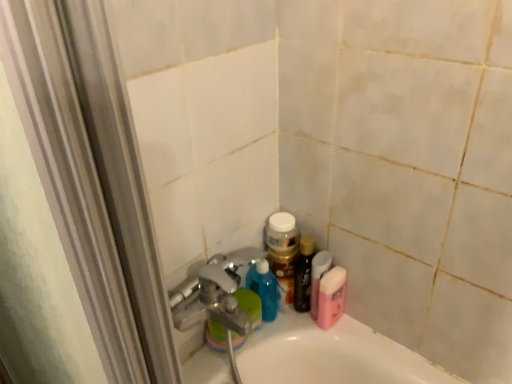
This screenshot has height=384, width=512. What do you see at coordinates (331, 297) in the screenshot? I see `pink matte bottle at lower right, which ranks as the 1th mouthwash in right-to-left order` at bounding box center [331, 297].

Locate an element on the screen. pink matte bottle at lower right, which is the second mouthwash from left to right is located at coordinates (331, 297).

Locate an element on the screen. mouthwash below the pink glossy bottle at upper right, which is the first mouthwash in left-to-right order (from a real-world perspective) is located at coordinates (331, 297).

What's the angular difference between pink matte bottle at lower right, which is the second mouthwash from left to right, and pink glossy bottle at upper right, which is the first mouthwash in left-to-right order,'s facing directions?

There is a 0.00181-degree angle between the facing directions of pink matte bottle at lower right, which is the second mouthwash from left to right, and pink glossy bottle at upper right, which is the first mouthwash in left-to-right order.

Who is bigger, pink matte bottle at lower right, which is the second mouthwash from left to right, or pink glossy bottle at upper right, marked as the second mouthwash in a right-to-left arrangement?

pink matte bottle at lower right, which is the second mouthwash from left to right.

In the scene shown: Can you confirm if pink matte bottle at lower right, which ranks as the 1th mouthwash in right-to-left order, is positioned to the right of pink glossy bottle at upper right, which is the first mouthwash in left-to-right order?

Yes, pink matte bottle at lower right, which ranks as the 1th mouthwash in right-to-left order, is to the right of pink glossy bottle at upper right, which is the first mouthwash in left-to-right order.

Is pink glossy bottle at upper right, which is the first mouthwash in left-to-right order, taller than shiny brown bottle at lower right?

No, pink glossy bottle at upper right, which is the first mouthwash in left-to-right order, is not taller than shiny brown bottle at lower right.

Are pink glossy bottle at upper right, marked as the second mouthwash in a right-to-left arrangement, and shiny brown bottle at lower right making contact?

Absolutely, pink glossy bottle at upper right, marked as the second mouthwash in a right-to-left arrangement, is next to and touching shiny brown bottle at lower right.

In terms of size, does pink glossy bottle at upper right, marked as the second mouthwash in a right-to-left arrangement, appear bigger or smaller than shiny brown bottle at lower right?

In the image, pink glossy bottle at upper right, marked as the second mouthwash in a right-to-left arrangement, appears to be smaller than shiny brown bottle at lower right.

Could you measure the distance between pink glossy bottle at upper right, which is the first mouthwash in left-to-right order, and shiny brown bottle at lower right?

They are 1.60 inches apart.

Which is behind, shiny brown bottle at lower right or pink matte bottle at lower right, which is the second mouthwash from left to right?

shiny brown bottle at lower right is behind.

Which point is more distant from viewer, (301, 264) or (332, 296)?

Positioned behind is point (301, 264).

Could you tell me if shiny brown bottle at lower right is turned towards pink matte bottle at lower right, which ranks as the 1th mouthwash in right-to-left order?

No, shiny brown bottle at lower right is not aimed at pink matte bottle at lower right, which ranks as the 1th mouthwash in right-to-left order.

Considering the sizes of objects shiny brown bottle at lower right and pink matte bottle at lower right, which ranks as the 1th mouthwash in right-to-left order, in the image provided, who is wider, shiny brown bottle at lower right or pink matte bottle at lower right, which ranks as the 1th mouthwash in right-to-left order,?

Wider between the two is pink matte bottle at lower right, which ranks as the 1th mouthwash in right-to-left order.

Can pink matte bottle at lower right, which ranks as the 1th mouthwash in right-to-left order, be found inside pink glossy bottle at upper right, marked as the second mouthwash in a right-to-left arrangement?

No, pink matte bottle at lower right, which ranks as the 1th mouthwash in right-to-left order, is not a part of pink glossy bottle at upper right, marked as the second mouthwash in a right-to-left arrangement.

Considering the sizes of pink glossy bottle at upper right, marked as the second mouthwash in a right-to-left arrangement, and pink matte bottle at lower right, which is the second mouthwash from left to right, in the image, is pink glossy bottle at upper right, marked as the second mouthwash in a right-to-left arrangement, taller or shorter than pink matte bottle at lower right, which is the second mouthwash from left to right,?

Clearly, pink glossy bottle at upper right, marked as the second mouthwash in a right-to-left arrangement, is taller compared to pink matte bottle at lower right, which is the second mouthwash from left to right.

From a real-world perspective, does pink glossy bottle at upper right, which is the first mouthwash in left-to-right order, stand above pink matte bottle at lower right, which is the second mouthwash from left to right?

Yes, from a real-world perspective, pink glossy bottle at upper right, which is the first mouthwash in left-to-right order, is over pink matte bottle at lower right, which is the second mouthwash from left to right

Can you tell me how much shiny brown bottle at lower right and pink glossy bottle at upper right, marked as the second mouthwash in a right-to-left arrangement, differ in facing direction?

0.00628 degrees separate the facing orientations of shiny brown bottle at lower right and pink glossy bottle at upper right, marked as the second mouthwash in a right-to-left arrangement.

Is shiny brown bottle at lower right turned away from pink glossy bottle at upper right, marked as the second mouthwash in a right-to-left arrangement?

That's not correct — shiny brown bottle at lower right is not looking away from pink glossy bottle at upper right, marked as the second mouthwash in a right-to-left arrangement.

Is shiny brown bottle at lower right located outside pink glossy bottle at upper right, which is the first mouthwash in left-to-right order?

Indeed, shiny brown bottle at lower right is completely outside pink glossy bottle at upper right, which is the first mouthwash in left-to-right order.

Considering the positions of objects shiny brown bottle at lower right and pink glossy bottle at upper right, which is the first mouthwash in left-to-right order, in the image provided, who is more to the right, shiny brown bottle at lower right or pink glossy bottle at upper right, which is the first mouthwash in left-to-right order,?

Positioned to the right is pink glossy bottle at upper right, which is the first mouthwash in left-to-right order.

Which point is more distant from viewer, (343, 280) or (307, 288)?

The point (307, 288) is farther from the camera.

Is pink matte bottle at lower right, which ranks as the 1th mouthwash in right-to-left order, positioned beyond the bounds of shiny brown bottle at lower right?

Yes, pink matte bottle at lower right, which ranks as the 1th mouthwash in right-to-left order, is located beyond the bounds of shiny brown bottle at lower right.

Consider the image. Does pink matte bottle at lower right, which ranks as the 1th mouthwash in right-to-left order, have a lesser width compared to shiny brown bottle at lower right?

No, pink matte bottle at lower right, which ranks as the 1th mouthwash in right-to-left order, is not thinner than shiny brown bottle at lower right.

Is pink matte bottle at lower right, which is the second mouthwash from left to right, turned away from shiny brown bottle at lower right?

No, pink matte bottle at lower right, which is the second mouthwash from left to right, is not facing the opposite direction of shiny brown bottle at lower right.

In order to click on mouthwash below the pink glossy bottle at upper right, which is the first mouthwash in left-to-right order (from a real-world perspective) in this screenshot , I will do `click(331, 297)`.

Starting from the shiny brown bottle at lower right, which mouthwash is the 2nd one in front? Please provide its 2D coordinates.

[(318, 278)]

Estimate the real-world distances between objects in this image. Which object is further from pink glossy bottle at upper right, which is the first mouthwash in left-to-right order, shiny brown bottle at lower right or pink matte bottle at lower right, which is the second mouthwash from left to right?

Based on the image, shiny brown bottle at lower right appears to be further to pink glossy bottle at upper right, which is the first mouthwash in left-to-right order.

From the image, which object appears to be nearer to pink glossy bottle at upper right, marked as the second mouthwash in a right-to-left arrangement, pink matte bottle at lower right, which is the second mouthwash from left to right, or shiny brown bottle at lower right?

The object closer to pink glossy bottle at upper right, marked as the second mouthwash in a right-to-left arrangement, is pink matte bottle at lower right, which is the second mouthwash from left to right.

Which object lies further to the anchor point pink matte bottle at lower right, which ranks as the 1th mouthwash in right-to-left order, pink glossy bottle at upper right, marked as the second mouthwash in a right-to-left arrangement, or shiny brown bottle at lower right?

shiny brown bottle at lower right is further to pink matte bottle at lower right, which ranks as the 1th mouthwash in right-to-left order.

Which object lies nearer to the anchor point shiny brown bottle at lower right, pink matte bottle at lower right, which is the second mouthwash from left to right, or pink glossy bottle at upper right, which is the first mouthwash in left-to-right order?

pink glossy bottle at upper right, which is the first mouthwash in left-to-right order, is closer to shiny brown bottle at lower right.

Looking at this image, from the image, which object appears to be farther from pink matte bottle at lower right, which ranks as the 1th mouthwash in right-to-left order, shiny brown bottle at lower right or pink glossy bottle at upper right, which is the first mouthwash in left-to-right order?

Based on the image, shiny brown bottle at lower right appears to be further to pink matte bottle at lower right, which ranks as the 1th mouthwash in right-to-left order.

Estimate the real-world distances between objects in this image. Which object is closer to shiny brown bottle at lower right, pink glossy bottle at upper right, marked as the second mouthwash in a right-to-left arrangement, or pink matte bottle at lower right, which ranks as the 1th mouthwash in right-to-left order?

pink glossy bottle at upper right, marked as the second mouthwash in a right-to-left arrangement, is closer to shiny brown bottle at lower right.

This screenshot has width=512, height=384. I want to click on mouthwash located between shiny brown bottle at lower right and pink matte bottle at lower right, which is the second mouthwash from left to right, in the left-right direction, so click(318, 278).